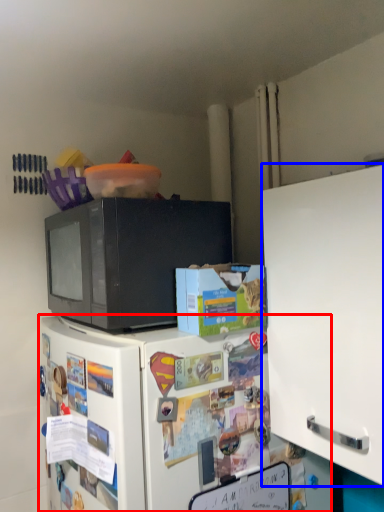
Question: Which object is closer to the camera taking this photo, refrigerator (highlighted by a red box) or cabinetry (highlighted by a blue box)?

Choices:
 (A) refrigerator
 (B) cabinetry

Answer: (B)